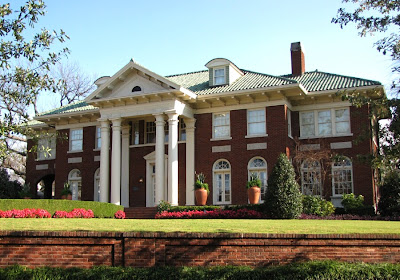
Identify the location of 1 chimney. (292, 67).